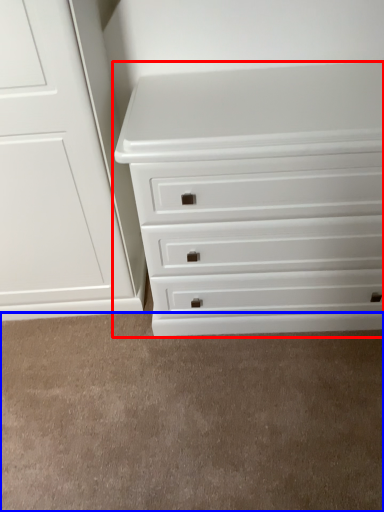
Question: Which of the following is the closest to the observer, chest of drawers (highlighted by a red box) or plain (highlighted by a blue box)?

Choices:
 (A) chest of drawers
 (B) plain

Answer: (A)